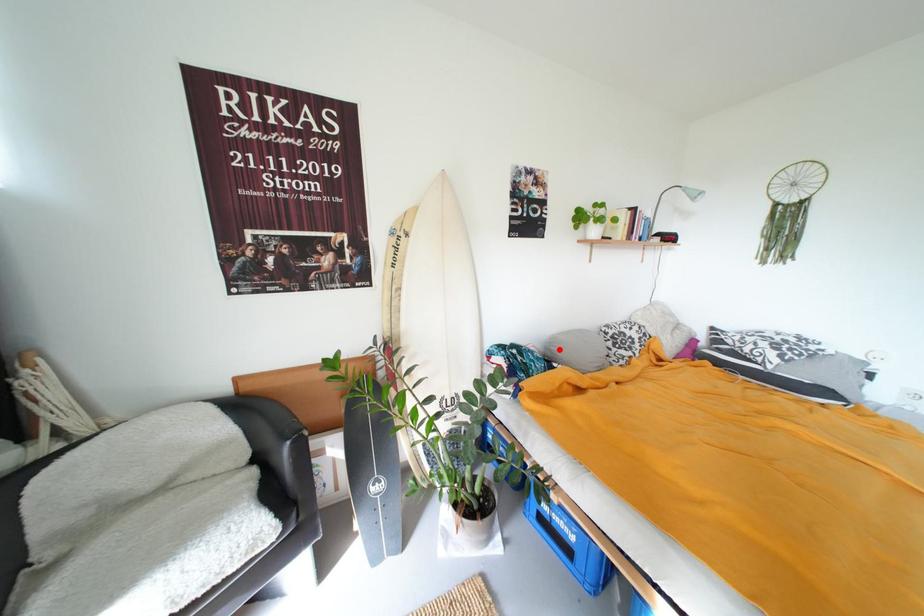
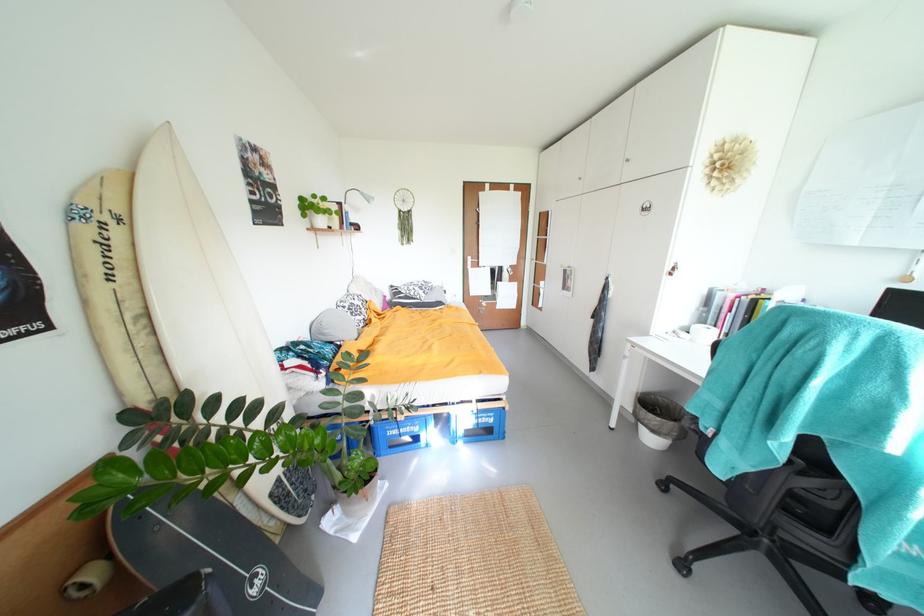
Question: I am providing you with two images of the same scene from different viewpoints. In image1, a red point is highlighted. Considering the same 3D point in image2, which of the following is correct?

Choices:
 (A) It is closer
 (B) It is farther

Answer: (A)